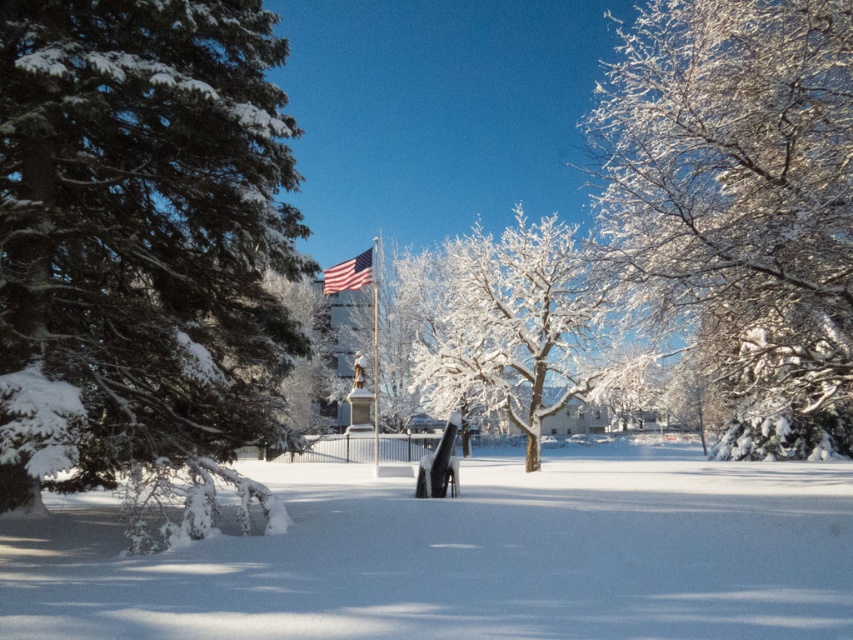
You are a photographer trying to capture the american flag at center without any obstructions. The white frosty tree at center is blocking your view. Can you move to the left or right to get a clear shot? Explain why.

The white frosty tree at center is in front of the american flag at center, so moving to the right would allow you to see around the tree and get a clear view of the american flag at center.

Based on the photo, you are a photographer wanting to capture the white frosty tree at center and the polished metal flag pole at center in a single shot. Which object appears higher in the image?

The white frosty tree at center appears higher than the polished metal flag pole at center in the image.